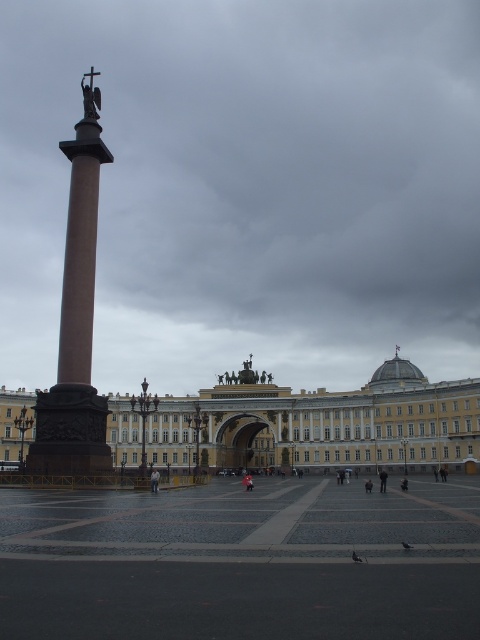
Question: Is bronze statue at center further to camera compared to gray feathered pigeon at lower center?

Choices:
 (A) yes
 (B) no

Answer: (A)

Question: Estimate the real-world distances between objects in this image. Which object is farther from the golden ornate building at center?

Choices:
 (A) brown polished column at left
 (B) smooth stone plaza at center
 (C) gray feathered pigeon at lower center

Answer: (C)

Question: Does smooth stone plaza at center appear on the left side of golden ornate building at center?

Choices:
 (A) no
 (B) yes

Answer: (A)

Question: Considering the real-world distances, which object is farthest from the gray feathered pigeon at lower center?

Choices:
 (A) smooth stone plaza at center
 (B) bronze statue at center

Answer: (B)

Question: Observing the image, what is the correct spatial positioning of smooth stone plaza at center in reference to gray feathered pigeon at lower center?

Choices:
 (A) above
 (B) below

Answer: (B)

Question: Which object is positioned closest to the brown polished column at left?

Choices:
 (A) smooth stone plaza at center
 (B) bronze statue at center
 (C) gray matte pigeon at lower right

Answer: (A)